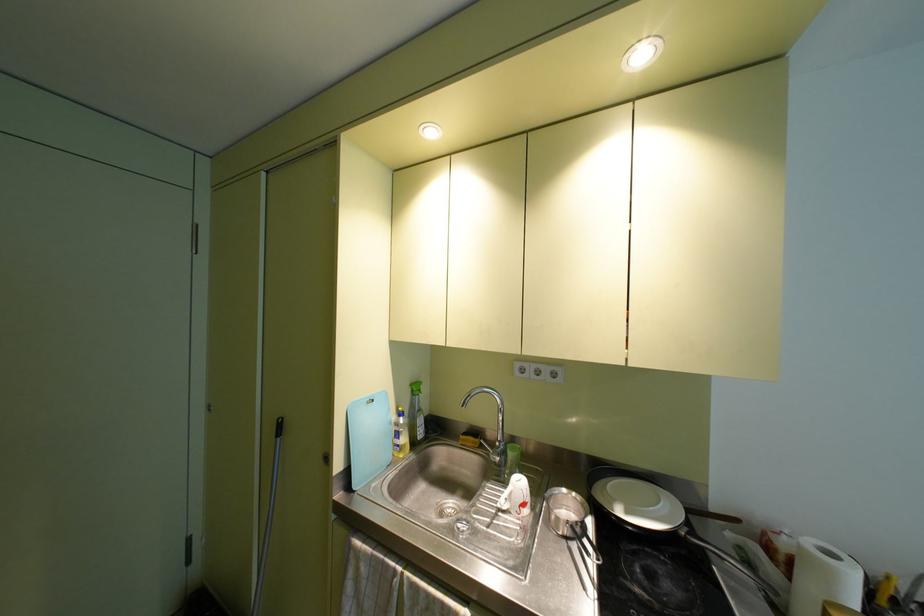
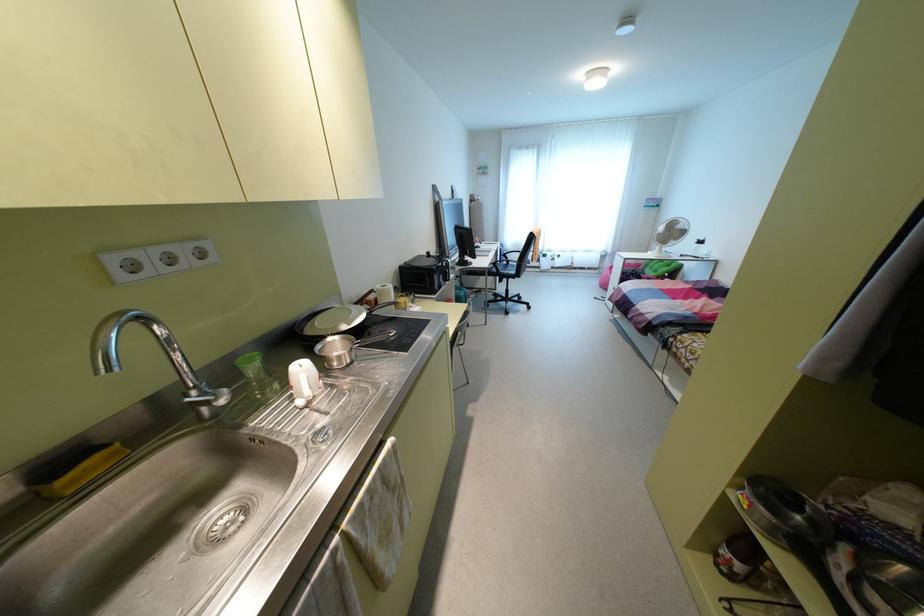
Where in the second image is the point corresponding to (x=626, y=512) from the first image?

(348, 323)